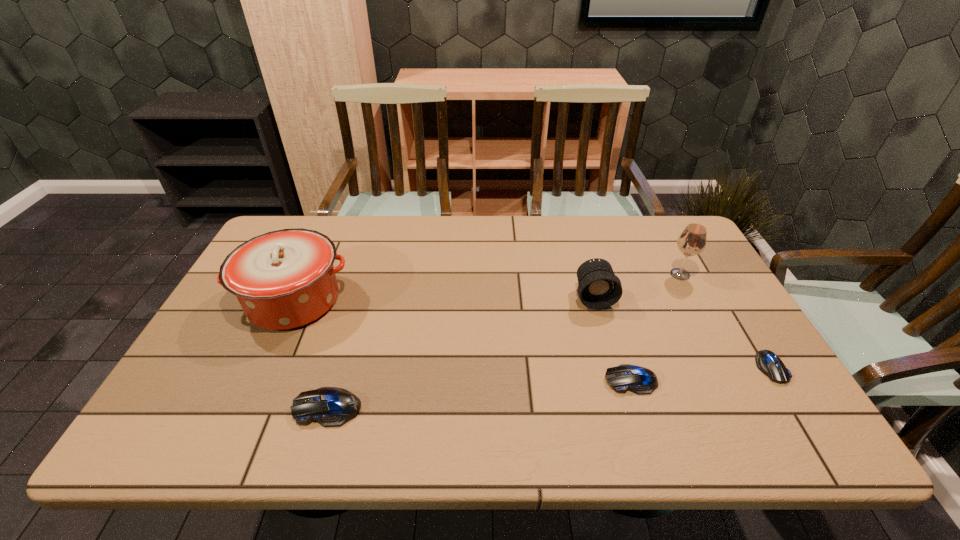
This screenshot has height=540, width=960. Find the location of `blank region between the telephoto lens and the casserole`. blank region between the telephoto lens and the casserole is located at coordinates (444, 299).

At what (x,y) coordinates should I click in order to perform the action: click on empty location between the telephoto lens and the fifth object from left to right. Please return your answer as a coordinate pair (x, y). This screenshot has height=540, width=960. Looking at the image, I should click on (636, 286).

You are a GUI agent. You are given a task and a screenshot of the screen. Output one action in this format:
    pyautogui.click(x=<x>, y=<y>)
    Task: Click on the empty space between the casserole and the shortest object
    The image size is (960, 540).
    Given the screenshot: What is the action you would take?
    pyautogui.click(x=533, y=334)

Where is `free space between the tallest computer mouse and the fifth object from left to right`? This screenshot has width=960, height=540. free space between the tallest computer mouse and the fifth object from left to right is located at coordinates (503, 341).

You are a GUI agent. You are given a task and a screenshot of the screen. Output one action in this format:
    pyautogui.click(x=<x>, y=<y>)
    Task: Click on the unoccupied position between the rightmost object and the leftmost computer mouse
    This screenshot has width=960, height=540.
    Given the screenshot: What is the action you would take?
    pyautogui.click(x=549, y=388)

Find the location of a particular element. The height and width of the screenshot is (540, 960). vacant space that is in between the casserole and the telephoto lens is located at coordinates (444, 299).

Where is `free space between the rightmost object and the telephoto lens`? free space between the rightmost object and the telephoto lens is located at coordinates (683, 332).

Identify the location of free space between the second computer mouse from right to left and the tallest computer mouse. This screenshot has height=540, width=960. (479, 394).

Find the location of a particular element. object identified as the closest to the tallest computer mouse is located at coordinates (285, 279).

Locate which object ranks in proximity to the wineglass. Please provide its 2D coordinates. Your answer should be formatted as a tuple, i.e. [(x, y)], where the tuple contains the x and y coordinates of a point satisfying the conditions above.

[(598, 287)]